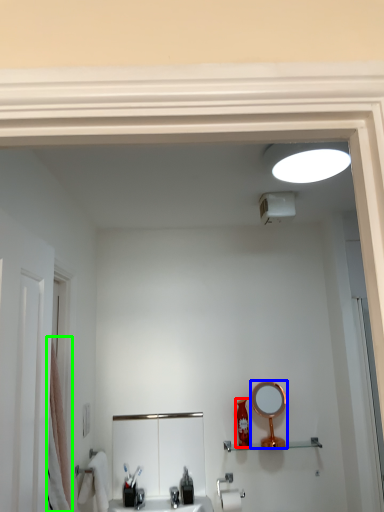
Question: Based on their relative distances, which object is nearer to toiletry (highlighted by a red box)? Choose from mirror (highlighted by a blue box) and shower curtain (highlighted by a green box).

Choices:
 (A) mirror
 (B) shower curtain

Answer: (A)